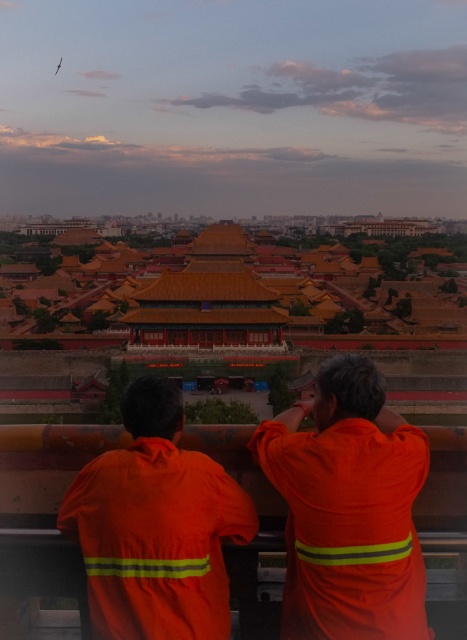
Which is above, orange fabric jacket at center or orange fabric jacket at lower center?

orange fabric jacket at center

Does point (317, 449) lie in front of point (162, 394)?

Yes, it is in front of point (162, 394).

Locate an element on the screen. This screenshot has width=467, height=640. orange fabric jacket at center is located at coordinates (347, 509).

Locate an element on the screen. Image resolution: width=467 pixels, height=640 pixels. orange fabric jacket at center is located at coordinates (347, 509).